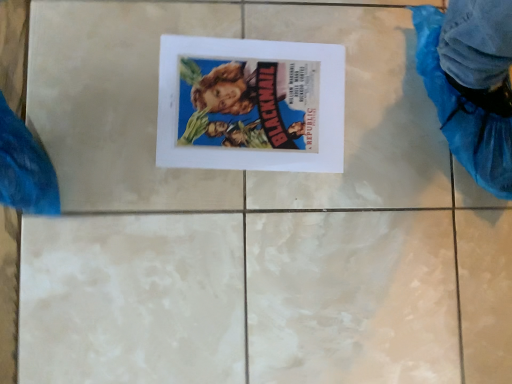
What are the coordinates of `matte paper poster at center` in the screenshot? It's located at 250,105.

Measure the distance between point (201,65) and camera.

Point (201,65) and camera are 26.73 inches apart.

What do you see at coordinates (250, 105) in the screenshot? Image resolution: width=512 pixels, height=384 pixels. I see `matte paper poster at center` at bounding box center [250, 105].

In order to click on matte paper poster at center in this screenshot , I will do `click(250, 105)`.